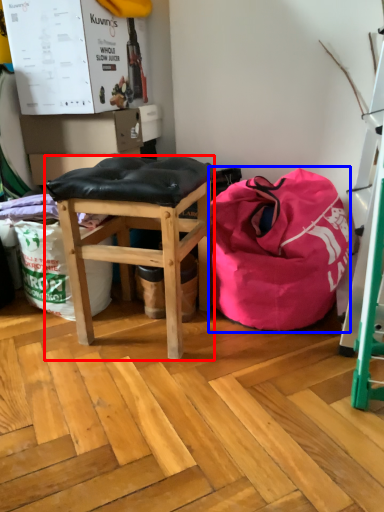
Question: Which point is closer to the camera, stool (highlighted by a red box) or bean bag chair (highlighted by a blue box)?

Choices:
 (A) stool
 (B) bean bag chair

Answer: (A)